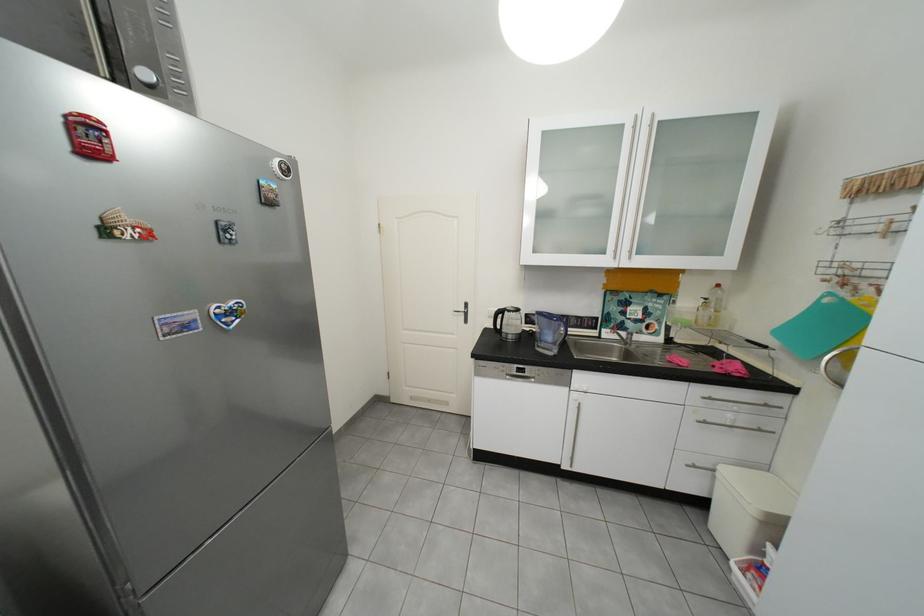
The width and height of the screenshot is (924, 616). Find the location of `bottle pump dispenser`. bottle pump dispenser is located at coordinates (714, 304).